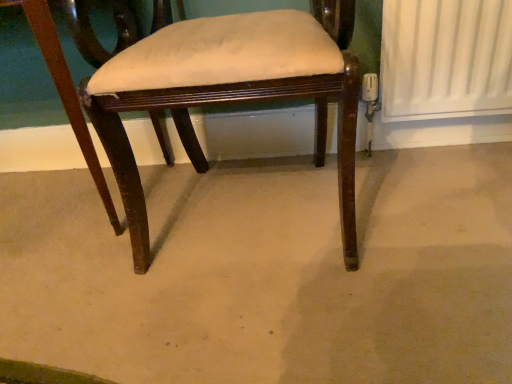
This screenshot has height=384, width=512. Find the location of `vacant area that is in front of mahogany wood chair at center`. vacant area that is in front of mahogany wood chair at center is located at coordinates (269, 319).